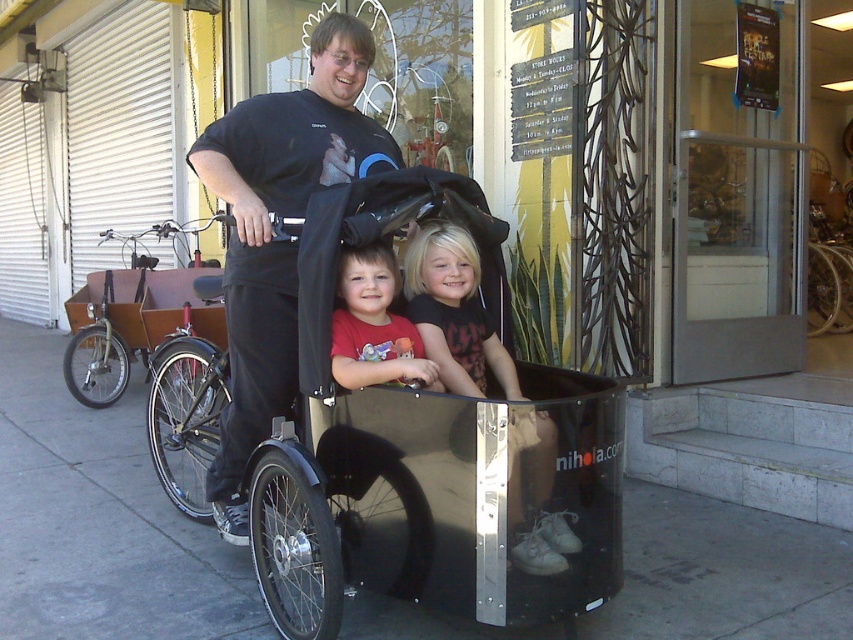
Question: Does shiny black cargo bike at center have a greater width compared to matte black child at center?

Choices:
 (A) yes
 (B) no

Answer: (A)

Question: Which point is closer to the camera taking this photo?

Choices:
 (A) (270, 374)
 (B) (459, 468)
 (C) (468, 237)
 (D) (73, 349)

Answer: (B)

Question: Among these points, which one is farthest from the camera?

Choices:
 (A) (672, 529)
 (B) (321, 243)
 (C) (532, 456)

Answer: (A)

Question: Does shiny black cargo bike at center have a smaller size compared to black rubber pavement at lower center?

Choices:
 (A) no
 (B) yes

Answer: (A)

Question: Among these objects, which one is farthest from the camera?

Choices:
 (A) black matte shirt at center
 (B) matte black child at center
 (C) matte red shirt at center
 (D) black rubber pavement at lower center

Answer: (D)

Question: Is black rubber pavement at lower center closer to camera compared to matte red shirt at center?

Choices:
 (A) no
 (B) yes

Answer: (A)